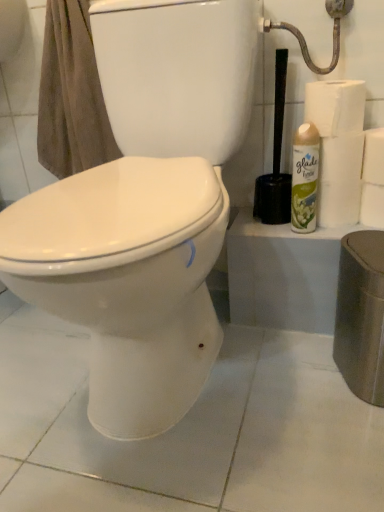
Question: Would you say brown cotton towel at upper left is to the left or to the right of white paper towel at right, marked as the 2th toilet paper in a bottom-to-top arrangement, in the picture?

Choices:
 (A) left
 (B) right

Answer: (A)

Question: Which is correct: brown cotton towel at upper left is inside white paper towel at right, marked as the 2th toilet paper in a bottom-to-top arrangement, or outside of it?

Choices:
 (A) outside
 (B) inside

Answer: (A)

Question: Based on their relative distances, which object is nearer to the black plastic toilet brush at right?

Choices:
 (A) white paper towel at upper right, arranged as the 4th toilet paper when ordered from the bottom
 (B) white paper towel at right, the 3th toilet paper in the top-to-bottom sequence
 (C) white paper at right, marked as the third toilet paper in a bottom-to-top arrangement
 (D) brown cotton towel at upper left
 (E) white paper at right, placed as the 4th toilet paper when sorted from top to bottom

Answer: (B)

Question: Which is nearer to the metallic silver showerhead at upper right?

Choices:
 (A) black plastic toilet brush at right
 (B) brown cotton towel at upper left
 (C) white paper towel at upper right, which ranks as the 1th toilet paper in top-to-bottom order
 (D) green matte air freshener at right
 (E) white paper at right, the first toilet paper from the bottom

Answer: (C)